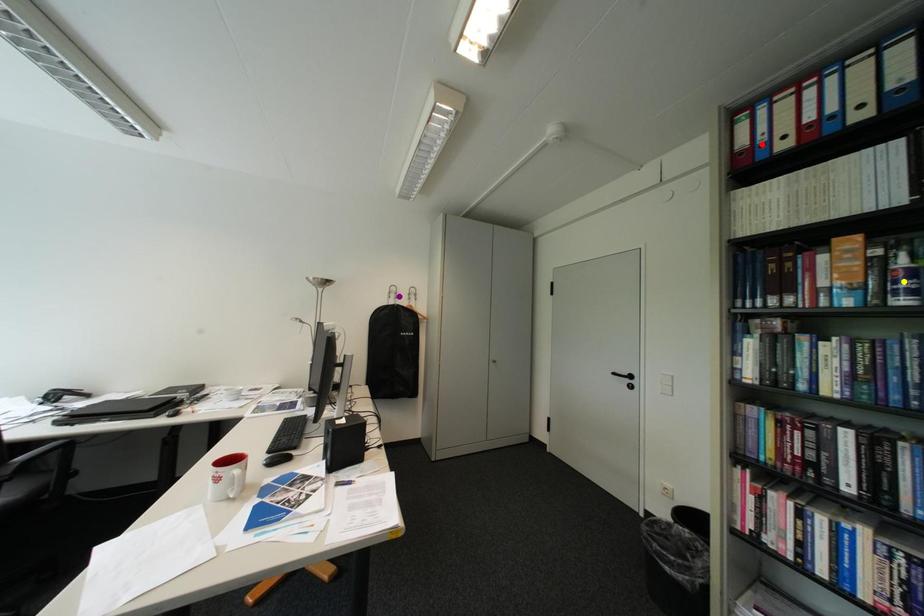
Order these from nearest to farthest:
A) red point
B) yellow point
C) purple point

purple point, red point, yellow point